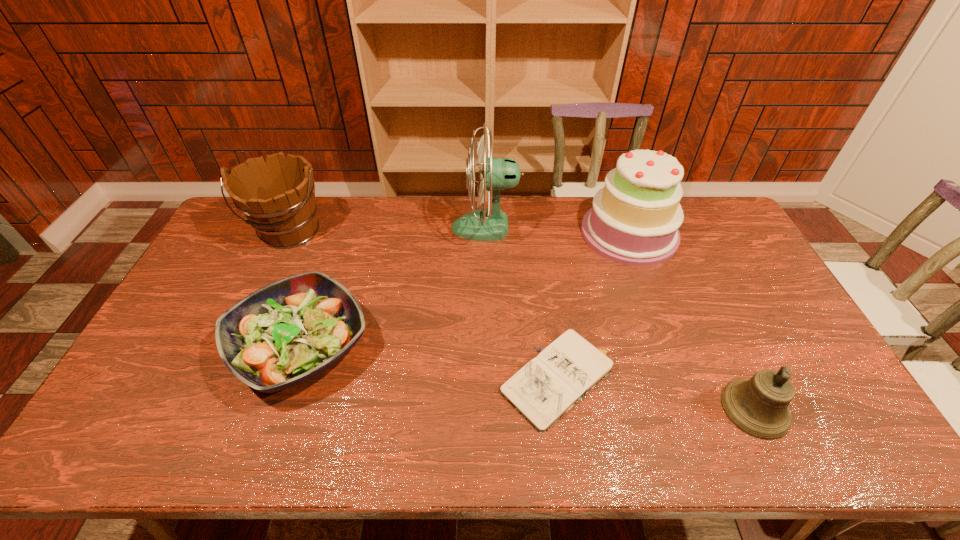
Identify the location of empty location between the fifth tallest object and the cake. This screenshot has height=540, width=960. (466, 290).

Where is `vacant area between the fan and the cake`? The height and width of the screenshot is (540, 960). vacant area between the fan and the cake is located at coordinates (558, 231).

This screenshot has height=540, width=960. Find the location of `vacant space that is in between the shortest object and the wine bucket`. vacant space that is in between the shortest object and the wine bucket is located at coordinates (425, 306).

What are the coordinates of `unoccupied position between the shortest object and the bell` in the screenshot? It's located at (659, 394).

Where is `empty space that is in between the salad plate and the shortest object`? The image size is (960, 540). empty space that is in between the salad plate and the shortest object is located at coordinates (432, 363).

You are a GUI agent. You are given a task and a screenshot of the screen. Output one action in this format:
    pyautogui.click(x=<x>, y=<y>)
    Task: Click on the free space between the wine bucket and the fourth tallest object
    
    Given the screenshot: What is the action you would take?
    pyautogui.click(x=522, y=320)

At what (x,y) coordinates should I click in order to perform the action: click on blank region between the tallest object and the fourth tallest object. Please return your answer as a coordinate pair (x, y). Looking at the image, I should click on (620, 318).

The image size is (960, 540). I want to click on vacant space that's between the cake and the fan, so click(x=558, y=231).

You are a GUI agent. You are given a task and a screenshot of the screen. Output one action in this format:
    pyautogui.click(x=<x>, y=<y>)
    Task: Click on the free space between the bell and the wine bucket
    This screenshot has width=960, height=540.
    Given the screenshot: What is the action you would take?
    pyautogui.click(x=522, y=320)

Locate which object is the closest to the notebook. Please provide its 2D coordinates. Your answer should be formatted as a tuple, i.e. [(x, y)], where the tuple contains the x and y coordinates of a point satisfying the conditions above.

[(758, 406)]